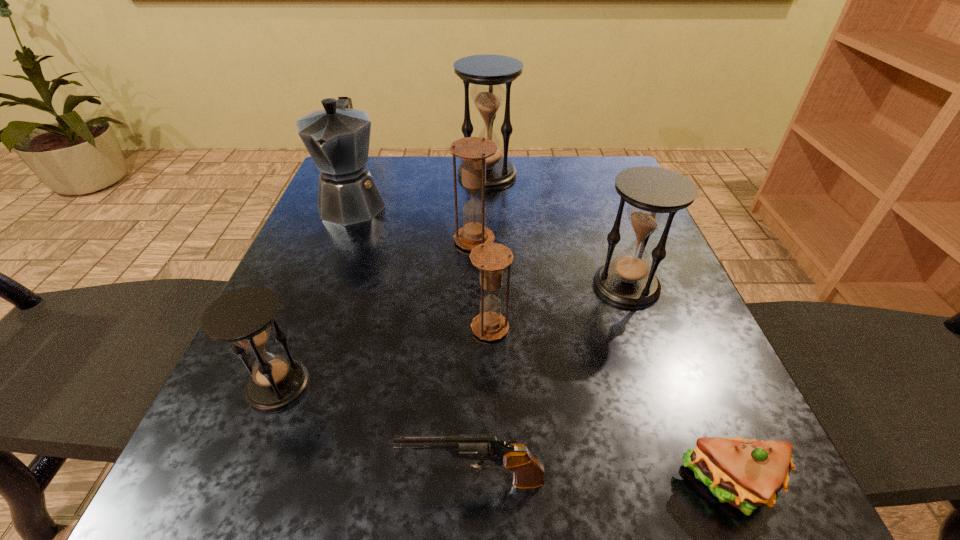
Locate an element on the screen. This screenshot has width=960, height=540. the farthest black hourglass is located at coordinates (487, 72).

In order to click on the second black hourglass from right to left in this screenshot , I will do `click(487, 72)`.

You are a GUI agent. You are given a task and a screenshot of the screen. Output one action in this format:
    pyautogui.click(x=<x>, y=<y>)
    Task: Click on the coffeepot
    This screenshot has height=540, width=960.
    Given the screenshot: What is the action you would take?
    pyautogui.click(x=337, y=138)

At what (x,y) coordinates should I click in order to perform the action: click on the bigger brown hourglass. Please return your answer as a coordinate pair (x, y). Image resolution: width=960 pixels, height=540 pixels. Looking at the image, I should click on (473, 151).

I want to click on the farther brown hourglass, so click(x=473, y=151).

Identify the location of the fifth nearest object. This screenshot has width=960, height=540. (654, 195).

Find the location of a particular element. the second nearest black hourglass is located at coordinates (654, 195).

I want to click on the fifth farthest object, so click(x=491, y=258).

What are the coordinates of `the nearer brown hourglass` in the screenshot? It's located at (491, 258).

I want to click on the nearest black hourglass, so click(x=243, y=316).